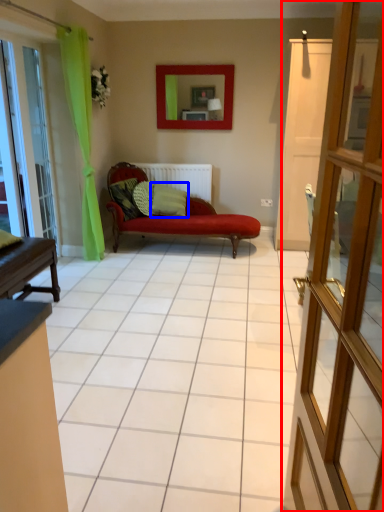
Question: Which of the following is the closest to the observer, door (highlighted by a red box) or pillow (highlighted by a blue box)?

Choices:
 (A) door
 (B) pillow

Answer: (A)